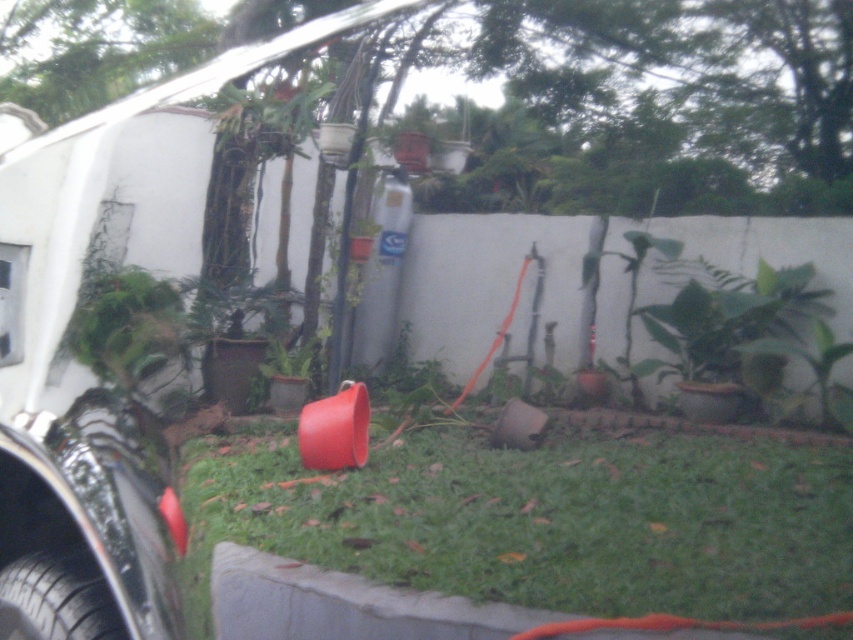
Who is more forward, (x=503, y=547) or (x=360, y=634)?

Point (x=360, y=634) is in front.

Which is above, green grass at center or gray concrete curb at lower left?

green grass at center is above.

This screenshot has height=640, width=853. In order to click on green grass at center in this screenshot , I will do `click(544, 518)`.

Does point (564, 516) come closer to viewer compared to point (103, 600)?

No, (564, 516) is further to viewer.

Does green grass at center appear on the right side of black rubber tire at lower left?

Indeed, green grass at center is positioned on the right side of black rubber tire at lower left.

Who is more distant from viewer, (489, 593) or (39, 584)?

Point (489, 593)

The width and height of the screenshot is (853, 640). Find the location of `green grass at center`. green grass at center is located at coordinates (544, 518).

Between gray concrete curb at lower left and black rubber tire at lower left, which one has more height?

gray concrete curb at lower left is taller.

Is gray concrete curb at lower left further to the viewer compared to black rubber tire at lower left?

Yes.

The width and height of the screenshot is (853, 640). I want to click on gray concrete curb at lower left, so click(387, 609).